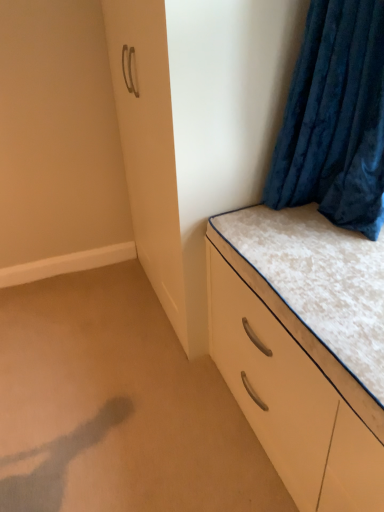
Image resolution: width=384 pixels, height=512 pixels. In order to click on free space in front of velvet blue curtain at upper right in this screenshot , I will do tap(331, 269).